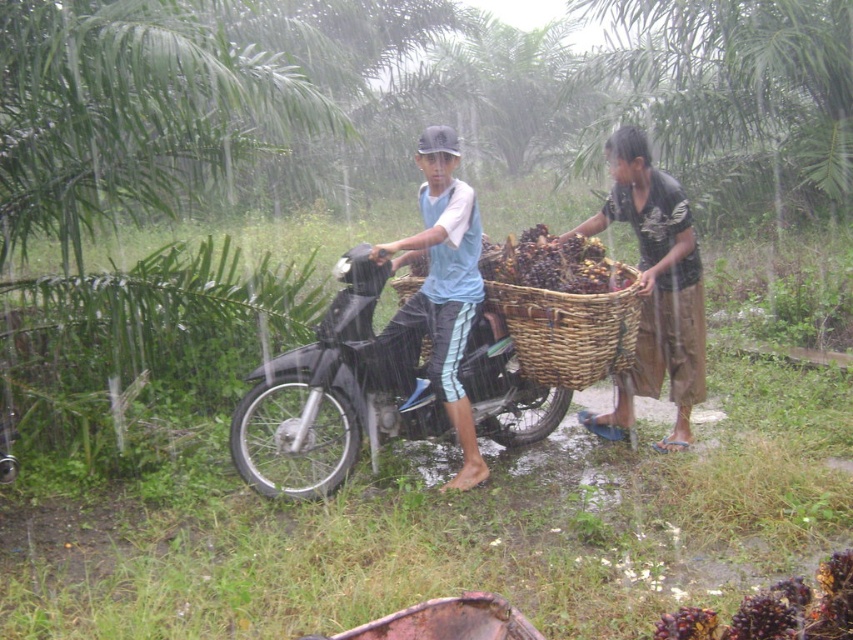
You are standing at the point with coordinates point (627,321) and want to walk towards point (689,324). Is the path clear? Please explain your reasoning based on the scene description.

The path between point (627,321) and point (689,324) is clear because point (689,324) is behind point (627,321), indicating no obstruction between them.

You are a delivery person who needs to place a heavy box on the motorcycle. You see the brown woven basket at right and the light blue fabric shirt at center in the image. Which object is located above the other?

The brown woven basket at right is positioned over light blue fabric shirt at center, so the basket is above the shirt.

You are a delivery person who needs to place a package between the brown woven basket at right and the light blue fabric shirt at center. Based on their positions, which object should you place the package closer to to ensure it is in front of both?

The brown woven basket at right is closer to the viewer than the light blue fabric shirt at center, so placing the package closer to the brown woven basket at right would position it in front of both objects.